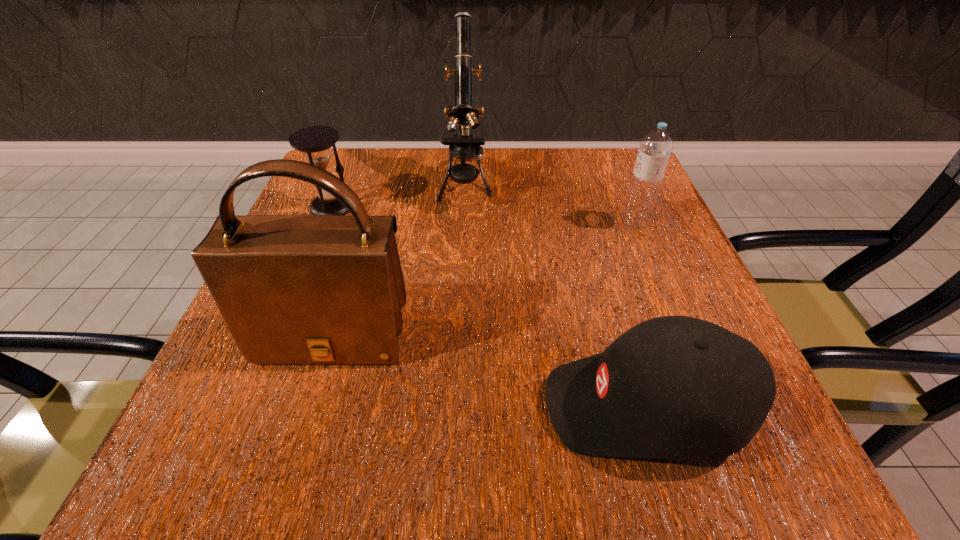
Identify the location of object at the near right corner. (674, 387).

Where is `free location at the far edge`? The image size is (960, 540). free location at the far edge is located at coordinates (511, 158).

This screenshot has height=540, width=960. I want to click on free space at the near edge of the desktop, so click(556, 442).

The height and width of the screenshot is (540, 960). Identify the location of free spot at the left edge of the desktop. (316, 411).

Identify the location of vacant region at the right edge. This screenshot has height=540, width=960. (584, 215).

Image resolution: width=960 pixels, height=540 pixels. What are the coordinates of `vacant point at the far left corner` in the screenshot? It's located at (304, 192).

This screenshot has width=960, height=540. In the image, there is a desktop. Identify the location of free space at the near left corner. (217, 463).

Locate an element on the screen. Image resolution: width=960 pixels, height=540 pixels. vacant area at the far right corner is located at coordinates (591, 162).

Find the location of a particular element. Image resolution: width=960 pixels, height=540 pixels. vacant region between the third object from right to left and the hourglass is located at coordinates (399, 196).

Locate an element on the screen. The height and width of the screenshot is (540, 960). empty space between the third tallest object and the shoulder bag is located at coordinates (484, 279).